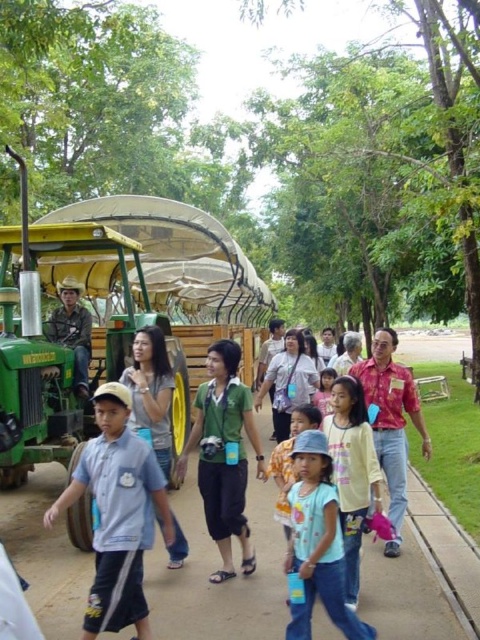
Which is more to the right, light blue cotton shirt at lower left or rustic wood chair at center?

light blue cotton shirt at lower left is more to the right.

Who is higher up, light blue cotton shirt at lower left or rustic wood chair at center?

rustic wood chair at center

Does point (144, 506) come behind point (83, 321)?

No, (144, 506) is in front of (83, 321).

Identify the location of light blue cotton shirt at lower left. Image resolution: width=480 pixels, height=640 pixels. pyautogui.click(x=118, y=515).

Does gray concrete pavement at center have a greater height compared to blue cotton shirt at center?

No, gray concrete pavement at center is not taller than blue cotton shirt at center.

Can you confirm if gray concrete pavement at center is positioned to the right of blue cotton shirt at center?

In fact, gray concrete pavement at center is to the left of blue cotton shirt at center.

Does point (273, 552) lie in front of point (316, 413)?

No.

In order to click on gray concrete pavement at center in this screenshot , I will do `click(215, 568)`.

How far apart are green matte shirt at center and blue cotton shirt at center?

41.97 centimeters

Looking at this image, who is lower down, green matte shirt at center or blue cotton shirt at center?

blue cotton shirt at center is below.

Locate an element on the screen. green matte shirt at center is located at coordinates (224, 454).

The width and height of the screenshot is (480, 640). I want to click on green matte shirt at center, so click(224, 454).